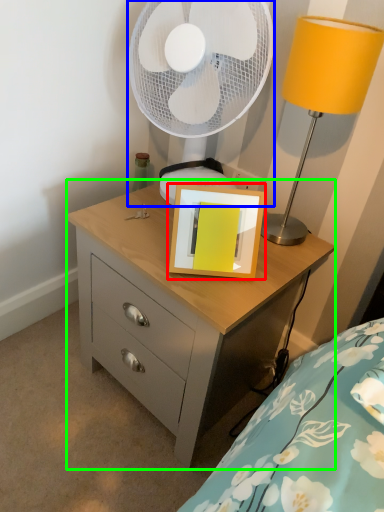
Question: Which object is the farthest from picture frame (highlighted by a red box)? Choose among these: mechanical fan (highlighted by a blue box) or chest of drawers (highlighted by a green box).

Choices:
 (A) mechanical fan
 (B) chest of drawers

Answer: (A)